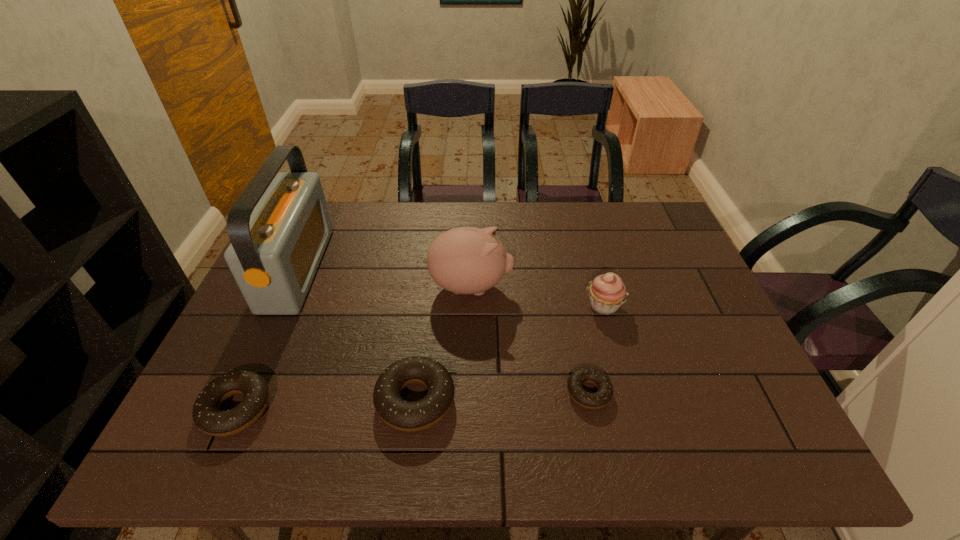
This screenshot has width=960, height=540. Find the location of `vacant space that satisfies the following two spatial constraints: 1. on the front-facing side of the second shortest doughnut; 2. on the left side of the radio receiver`. vacant space that satisfies the following two spatial constraints: 1. on the front-facing side of the second shortest doughnut; 2. on the left side of the radio receiver is located at coordinates (234, 409).

You are a GUI agent. You are given a task and a screenshot of the screen. Output one action in this format:
    pyautogui.click(x=<x>, y=<y>)
    Task: Click on the free space in the image that satisfies the following two spatial constraints: 1. at the snout of the piggy bank; 2. on the left side of the rightmost doughnut
    This screenshot has height=540, width=960.
    Given the screenshot: What is the action you would take?
    pyautogui.click(x=468, y=392)

At what (x,y) coordinates should I click in order to perform the action: click on free space that satisfies the following two spatial constraints: 1. on the front-facing side of the tallest object; 2. on the left side of the second doughnut from left to right. Please return your answer as a coordinate pair (x, y). This screenshot has height=540, width=960. Looking at the image, I should click on [238, 400].

Locate an element on the screen. This screenshot has width=960, height=540. free space that satisfies the following two spatial constraints: 1. on the front-facing side of the tallest object; 2. on the right side of the second doughnut from right to left is located at coordinates (x=238, y=400).